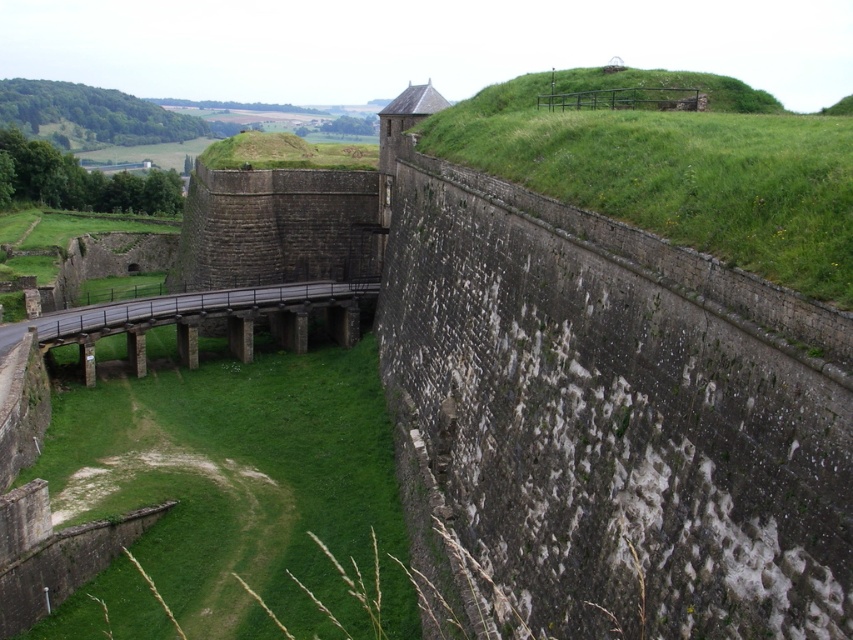
You are standing at the base of the fortification wall and looking up at the rampart. There are two points marked on the wall. Which point, point (339, 540) or point (248, 358), is closer to you?

Point (339, 540) is closer to the viewer than point (248, 358).